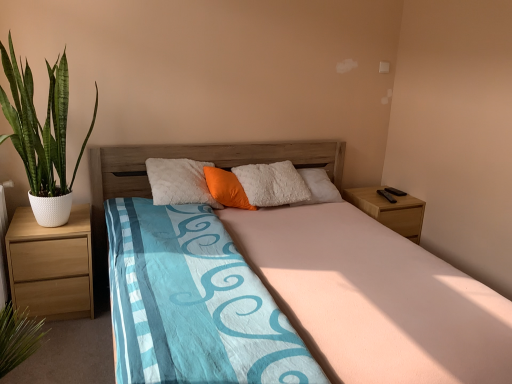
Question: Does wooden bed at center appear on the right side of orange fabric pillow at center?

Choices:
 (A) yes
 (B) no

Answer: (A)

Question: Could you tell me if wooden bed at center is facing orange fabric pillow at center?

Choices:
 (A) yes
 (B) no

Answer: (B)

Question: Does wooden bed at center have a larger size compared to orange fabric pillow at center?

Choices:
 (A) yes
 (B) no

Answer: (A)

Question: Considering the relative sizes of wooden bed at center and orange fabric pillow at center in the image provided, is wooden bed at center shorter than orange fabric pillow at center?

Choices:
 (A) yes
 (B) no

Answer: (B)

Question: Is orange fabric pillow at center at the back of wooden bed at center?

Choices:
 (A) no
 (B) yes

Answer: (B)

Question: Does point (65, 178) appear closer or farther from the camera than point (204, 168)?

Choices:
 (A) farther
 (B) closer

Answer: (B)

Question: Based on their sizes in the image, would you say green leafy plant in textured pot at left is bigger or smaller than orange fabric pillow at center?

Choices:
 (A) small
 (B) big

Answer: (B)

Question: In terms of width, does green leafy plant in textured pot at left look wider or thinner when compared to orange fabric pillow at center?

Choices:
 (A) thin
 (B) wide

Answer: (B)

Question: Is green leafy plant in textured pot at left taller or shorter than orange fabric pillow at center?

Choices:
 (A) tall
 (B) short

Answer: (A)

Question: Would you say orange fabric pillow at center is to the left or to the right of wooden bed at center in the picture?

Choices:
 (A) left
 (B) right

Answer: (A)

Question: Is point (212, 185) closer or farther from the camera than point (337, 352)?

Choices:
 (A) farther
 (B) closer

Answer: (A)

Question: Considering the positions of orange fabric pillow at center and wooden bed at center in the image, is orange fabric pillow at center taller or shorter than wooden bed at center?

Choices:
 (A) short
 (B) tall

Answer: (A)

Question: Considering the positions of orange fabric pillow at center and wooden bed at center in the image, is orange fabric pillow at center bigger or smaller than wooden bed at center?

Choices:
 (A) big
 (B) small

Answer: (B)

Question: Does point (353, 364) appear closer or farther from the camera than point (49, 294)?

Choices:
 (A) farther
 (B) closer

Answer: (B)

Question: Looking at their shapes, would you say wooden bed at center is wider or thinner than light brown wood at left, which ranks as the second nightstand in back-to-front order?

Choices:
 (A) thin
 (B) wide

Answer: (B)